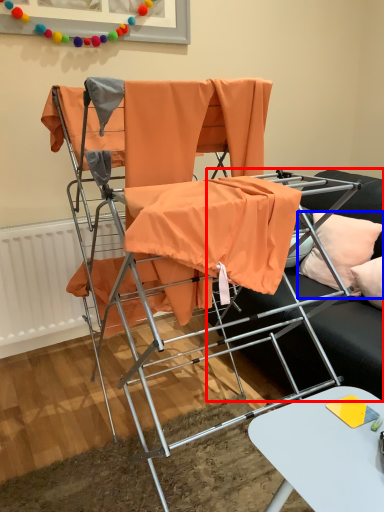
Question: Which of the following is the farthest to the observer, studio couch (highlighted by a red box) or pillow (highlighted by a blue box)?

Choices:
 (A) studio couch
 (B) pillow

Answer: (B)